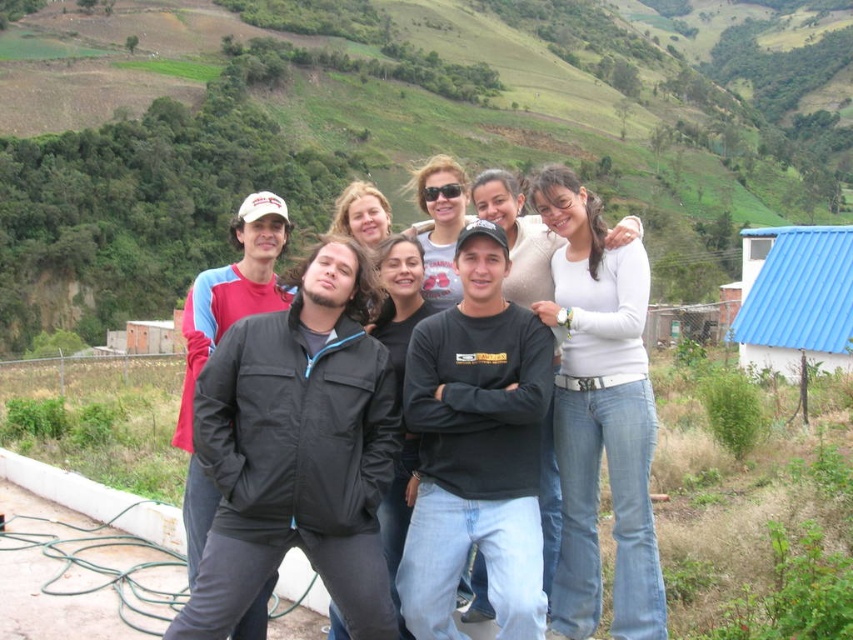
Question: Among these points, which one is farthest from the camera?

Choices:
 (A) (218, 468)
 (B) (316, 125)
 (C) (631, 484)

Answer: (B)

Question: Which point is farther from the camera taking this photo?

Choices:
 (A) (730, 236)
 (B) (660, 636)
 (C) (323, 380)

Answer: (A)

Question: Is black matte jacket at center thinner than white matte shirt at center?

Choices:
 (A) no
 (B) yes

Answer: (A)

Question: Which object is the closest to the white matte shirt at center?

Choices:
 (A) black matte jacket at center
 (B) green grassy hillside at upper center

Answer: (A)

Question: Can you confirm if green grassy hillside at upper center is thinner than black matte jacket at center?

Choices:
 (A) yes
 (B) no

Answer: (B)

Question: Where is green grassy hillside at upper center located in relation to white matte shirt at center in the image?

Choices:
 (A) right
 (B) left

Answer: (A)